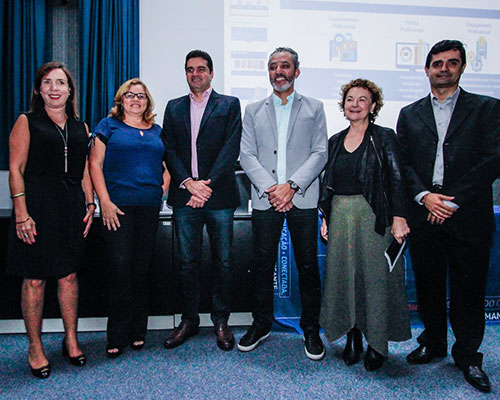
The width and height of the screenshot is (500, 400). Identify the location of dark blue curtains. (101, 42), (27, 38).